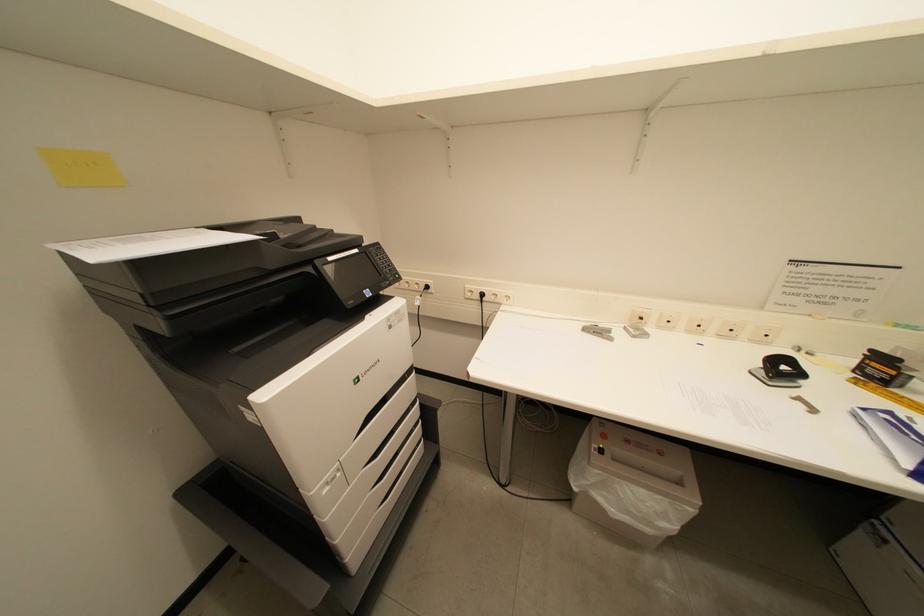
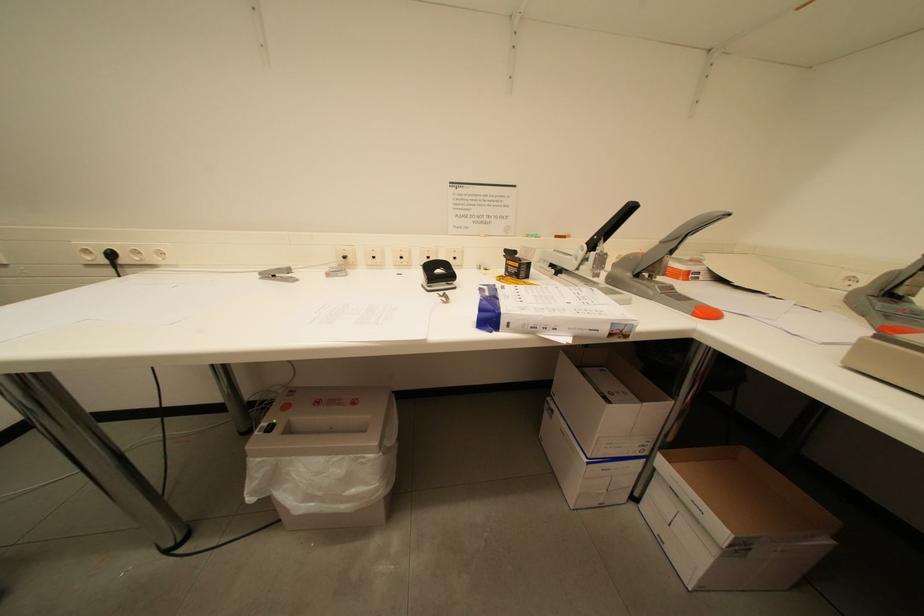
Question: The images are taken continuously from a first-person perspective. In which direction is your viewpoint rotating?

Choices:
 (A) Left
 (B) Right
 (C) Up
 (D) Down

Answer: (B)